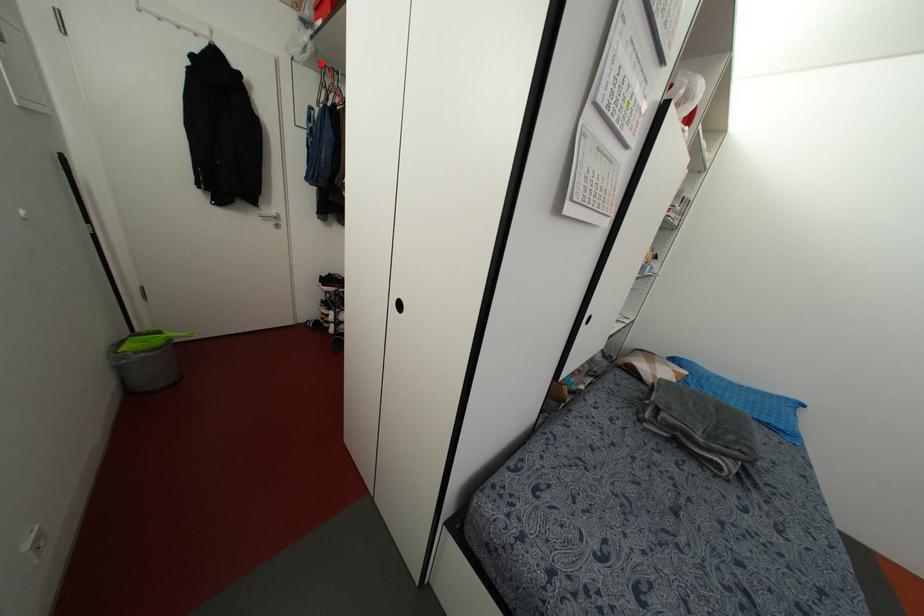
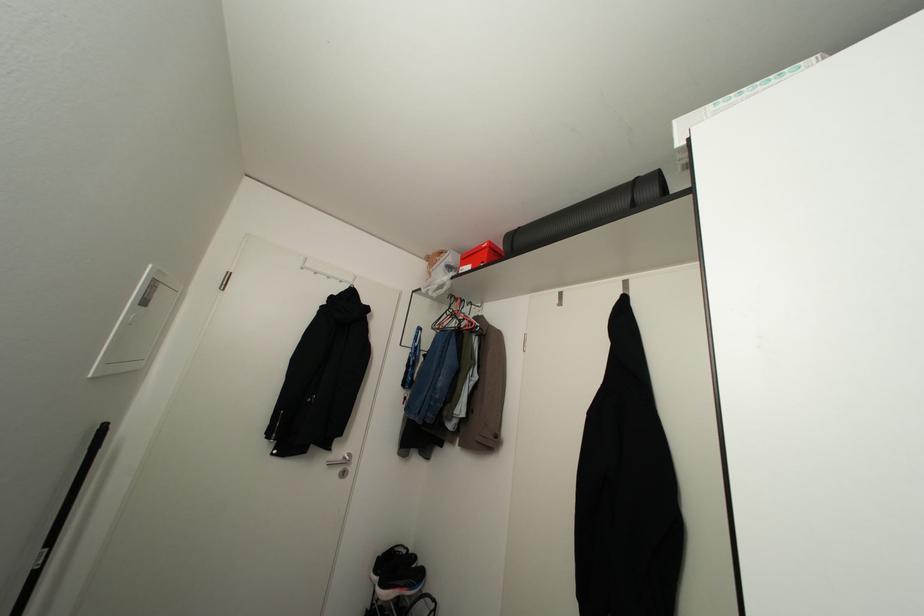
Find the pixel in the second image that matches the highlighted location in the first image.

(451, 294)